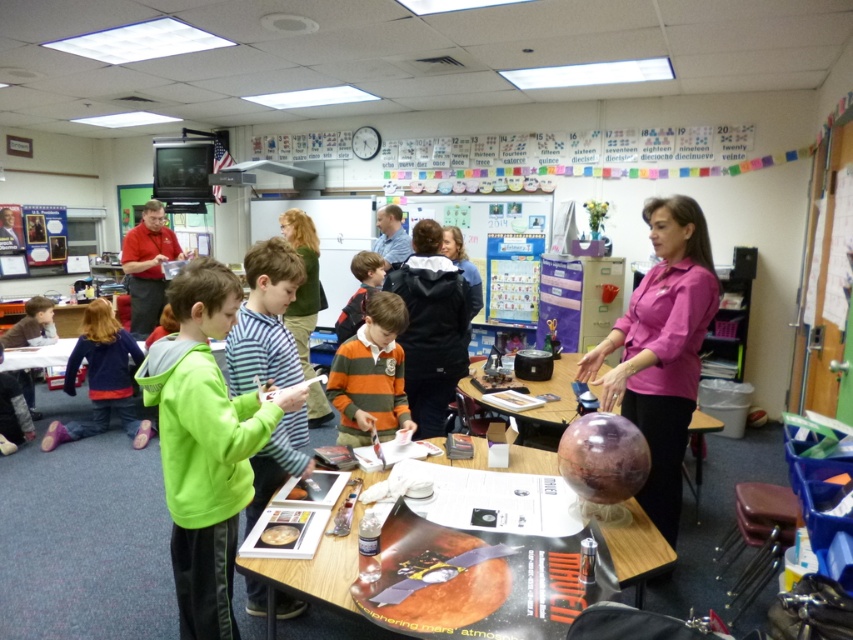
Question: Estimate the real-world distances between objects in this image. Which object is farther from the green striped sweater at center?

Choices:
 (A) matte red shirt at left
 (B) striped cotton shirt at center
 (C) metallic silver table at center
 (D) purple fleece jacket at lower left

Answer: (A)

Question: Considering the relative positions of pink matte shirt at center and metallic silver table at center in the image provided, where is pink matte shirt at center located with respect to metallic silver table at center?

Choices:
 (A) left
 (B) right

Answer: (B)

Question: Can you confirm if green fleece jacket at center is positioned above striped cotton shirt at center?

Choices:
 (A) yes
 (B) no

Answer: (B)

Question: Is green fleece jacket at center above striped cotton shirt at center?

Choices:
 (A) no
 (B) yes

Answer: (A)

Question: Which of these objects is positioned farthest from the pink matte shirt at center?

Choices:
 (A) shiny metallic table at center
 (B) matte red shirt at left
 (C) green striped sweater at center
 (D) green fleece jacket at center

Answer: (B)

Question: Considering the real-world distances, which object is farthest from the striped cotton shirt at center?

Choices:
 (A) pink matte shirt at center
 (B) shiny metallic table at center
 (C) purple fleece jacket at lower left
 (D) green striped sweater at center

Answer: (C)